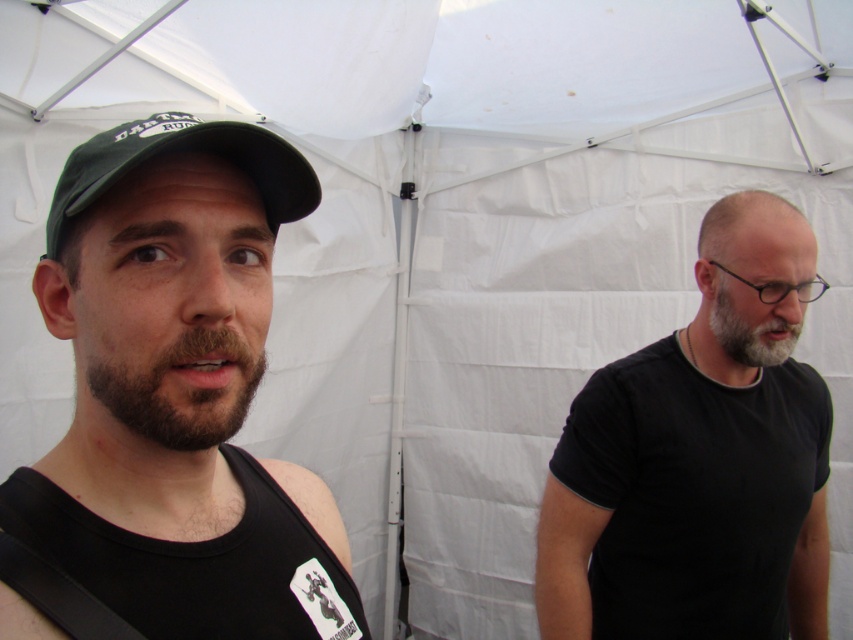
Consider the image. You are a photographer trying to capture both the dark brown fuzzy beard at left and the gray matte beard at center in a single shot. Based on their heights, which beard should you focus on to ensure both are in frame without cropping?

Since the dark brown fuzzy beard at left is shorter than the gray matte beard at center, you should focus on the gray matte beard at center to ensure both are in frame without cropping.

You are a photographer taking a portrait of two men under a white canopy tent. You need to ensure both subjects are framed properly. Which beard, the dark brown fuzzy beard at left or the gray matte beard at center, is positioned closer to the left side of the frame?

The dark brown fuzzy beard at left is positioned closer to the left side of the frame because it is to the left of the gray matte beard at center.

Based on the coordinates provided, can you identify which part of the person in the foreground is located at point (187, 392)?

The point (187, 392) corresponds to the dark brown fuzzy beard at left.